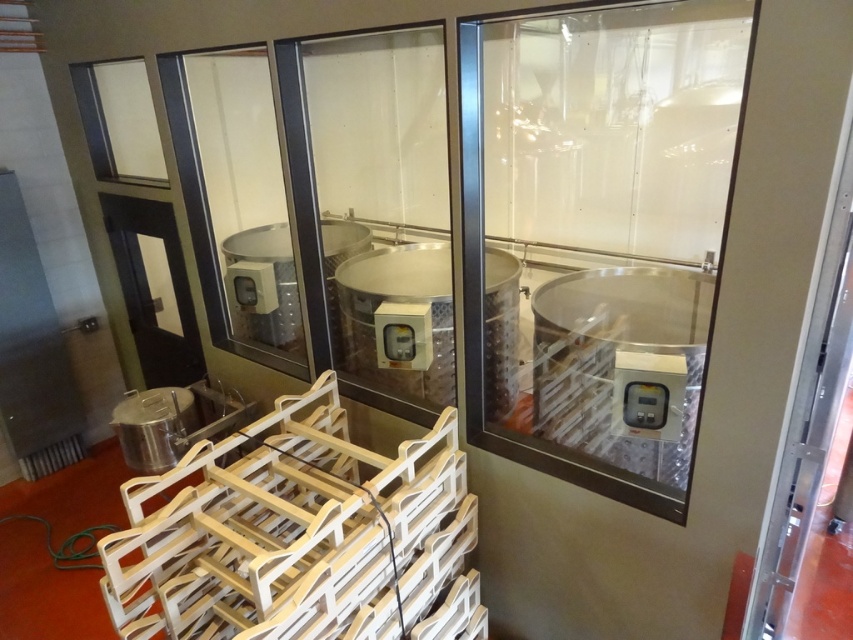
You are standing in the industrial setting and want to take a photo of the two points mentioned. Which point, point (300, 497) or point (325, 60), will appear larger in your photo?

Point (300, 497) will appear larger in the photo because it is closer to the camera than point (325, 60).

Based on the photo, you are a delivery person trying to place a new crate that is 24 inches wide into the space between the light wood crate at center and the transparent glass door at center. Can the crate fit in the space between them?

The space between the light wood crate at center and the transparent glass door at center is 23.68 inches. Since the new crate is 24 inches wide, it cannot fit in the space between them.